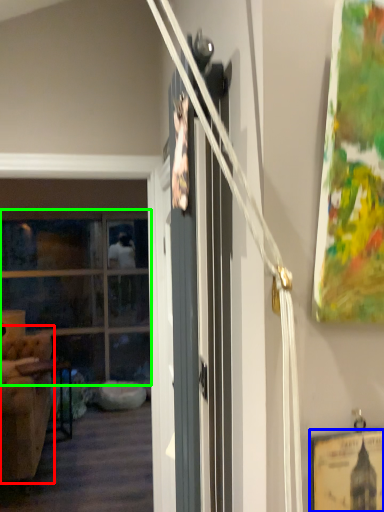
Question: Based on their relative distances, which object is nearer to armchair (highlighted by a red box)? Choose from picture frame (highlighted by a blue box) and window (highlighted by a green box).

Choices:
 (A) picture frame
 (B) window

Answer: (B)